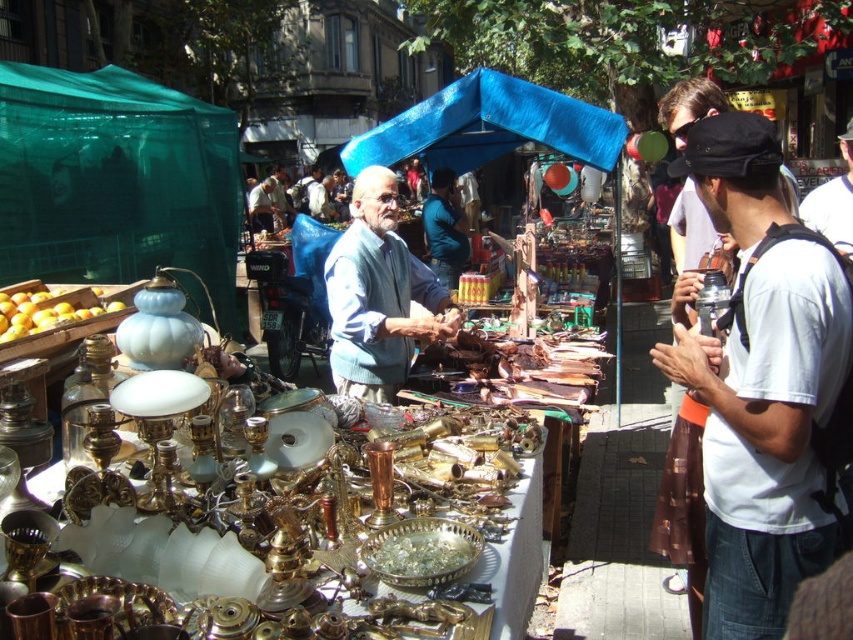
You are standing at the entrance of the market and want to reach a vendor located at point (x=618, y=141). There is an obstacle at point (x=364, y=172). Will you have to go around the obstacle to reach your destination?

Point (x=364, y=172) is in front of point (x=618, y=141), so you will have to go around the obstacle at point (x=364, y=172) to reach your destination.

You are a customer at the market and want to buy the blue cotton shirt at center. Where exactly is it located on the image?

The blue cotton shirt at center is located at point coordinates of (379,296).